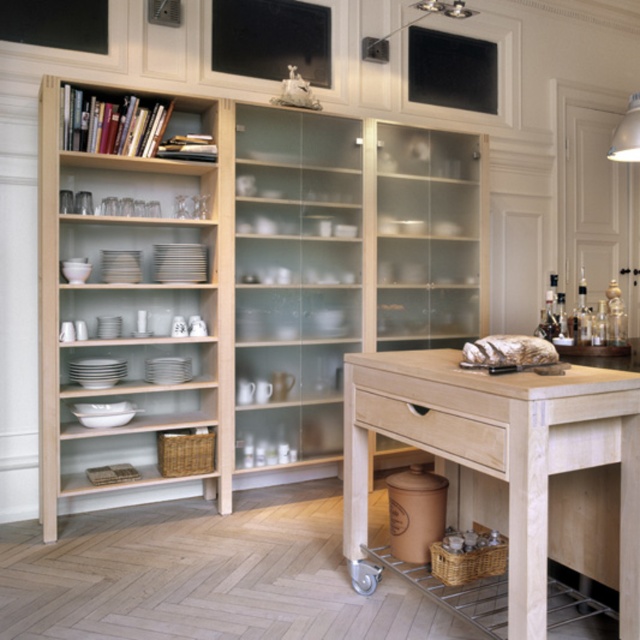
Question: Is natural wood bookshelf at upper left thinner than light wood bookshelf at left?

Choices:
 (A) yes
 (B) no

Answer: (B)

Question: Which point appears closest to the camera in this image?

Choices:
 (A) (346, 259)
 (B) (232, 202)

Answer: (B)

Question: Which of the following is the farthest from the observer?

Choices:
 (A) (445, 406)
 (B) (436, 428)

Answer: (B)

Question: Which point is farther to the camera?

Choices:
 (A) light wood bookshelf at left
 (B) light wood table at center

Answer: (A)

Question: Does natural wood bookshelf at upper left appear on the right side of light wood bookshelf at left?

Choices:
 (A) yes
 (B) no

Answer: (A)

Question: Can you confirm if light wood table at center is positioned to the left of light wood drawer at center?

Choices:
 (A) no
 (B) yes

Answer: (A)